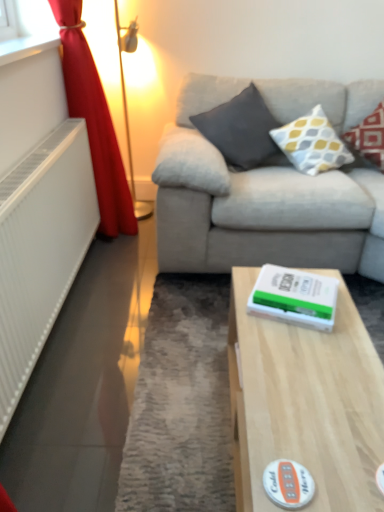
At what (x,y) coordinates should I click in order to perform the action: click on vacant space underneath white plastic radiator at left (from a real-world perspective). Please return your answer as a coordinate pair (x, y). The width and height of the screenshot is (384, 512). Looking at the image, I should click on (62, 319).